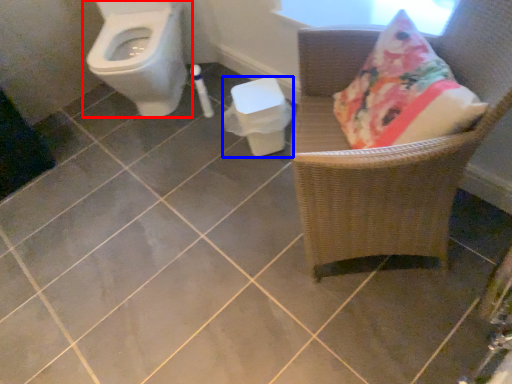
Question: Which object appears closest to the camera in this image, toilet (highlighted by a red box) or potty (highlighted by a blue box)?

Choices:
 (A) toilet
 (B) potty

Answer: (A)